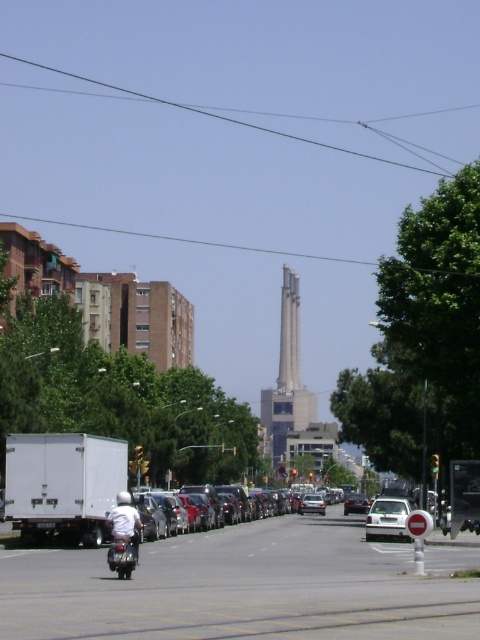
Question: Based on their relative distances, which object is farther from the shiny silver sedan at center?

Choices:
 (A) white matte car at center
 (B) clear wire at upper center
 (C) black wire at upper center
 (D) white matte motorcyclist at center

Answer: (B)

Question: Which is farther from the shiny chrome motorcycle at center?

Choices:
 (A) black wire at upper center
 (B) shiny silver sedan at center

Answer: (A)

Question: Can you confirm if clear wire at upper center is smaller than shiny silver sedan at center?

Choices:
 (A) yes
 (B) no

Answer: (B)

Question: Can you confirm if clear wire at upper center is smaller than white matte motorcyclist at center?

Choices:
 (A) yes
 (B) no

Answer: (B)

Question: Can you confirm if clear wire at upper center is positioned below gray concrete tower at center?

Choices:
 (A) yes
 (B) no

Answer: (B)

Question: Which object is farther from the camera taking this photo?

Choices:
 (A) concrete tower at center
 (B) white matte car at center

Answer: (A)